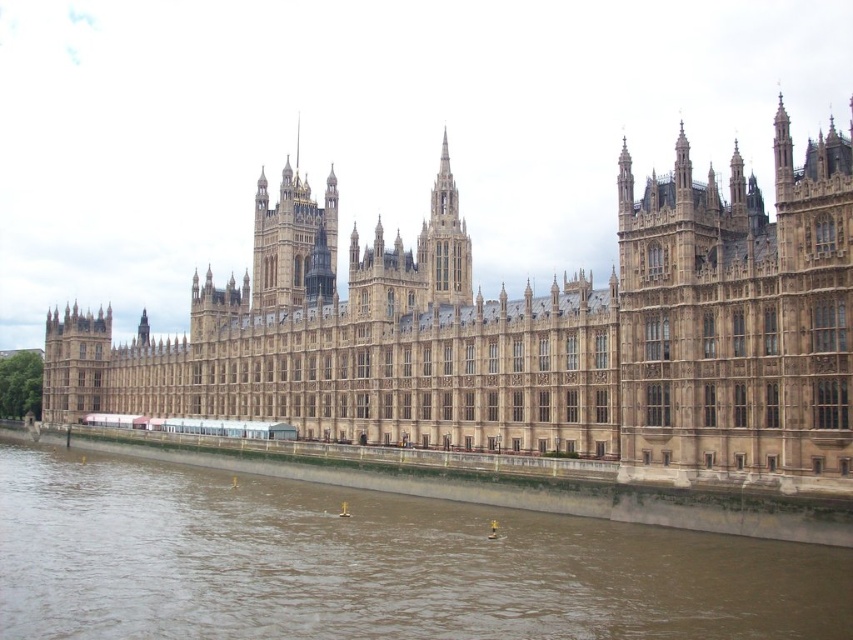
Question: Does brown stone castle at center appear on the left side of smooth stone spire at center?

Choices:
 (A) no
 (B) yes

Answer: (A)

Question: Which of the following is the farthest from the observer?

Choices:
 (A) (440, 252)
 (B) (848, 637)
 (C) (555, 445)

Answer: (A)

Question: Does brown sedimentary river at lower left come behind smooth stone spire at center?

Choices:
 (A) yes
 (B) no

Answer: (B)

Question: Which object is the closest to the smooth stone spire at center?

Choices:
 (A) brown sedimentary river at lower left
 (B) brown stone castle at center

Answer: (B)

Question: Does brown stone castle at center appear on the left side of brown sedimentary river at lower left?

Choices:
 (A) no
 (B) yes

Answer: (A)

Question: Which point is closer to the camera?

Choices:
 (A) smooth stone spire at center
 (B) brown sedimentary river at lower left
 (C) brown stone castle at center

Answer: (B)